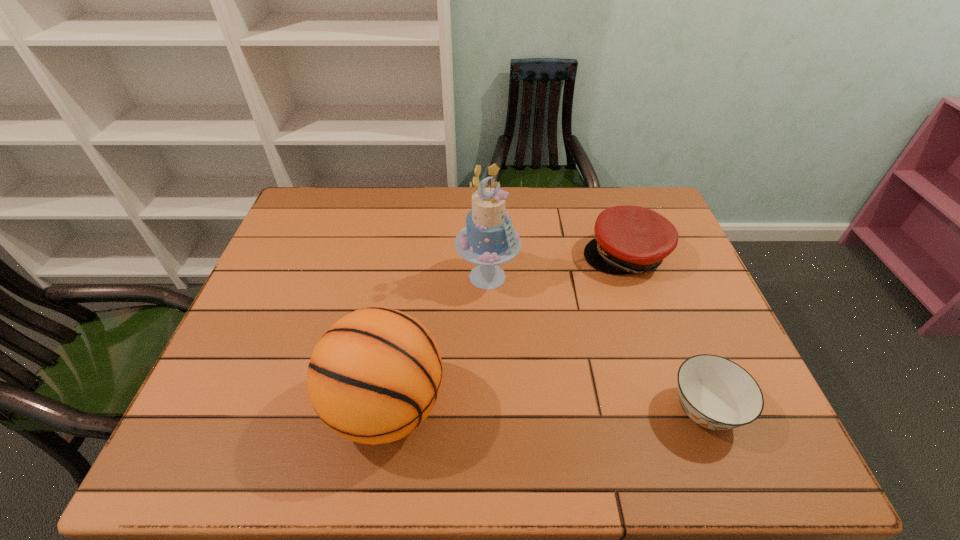
The height and width of the screenshot is (540, 960). In order to click on the leftmost object in this screenshot , I will do `click(374, 376)`.

Image resolution: width=960 pixels, height=540 pixels. In order to click on basketball in this screenshot , I will do `click(374, 376)`.

Locate an element on the screen. The image size is (960, 540). the shortest object is located at coordinates (x=716, y=393).

This screenshot has height=540, width=960. I want to click on cake, so click(489, 239).

Locate an element on the screen. The width and height of the screenshot is (960, 540). the tallest object is located at coordinates (489, 239).

Find the location of `the second shortest object`. the second shortest object is located at coordinates (628, 239).

Locate an element on the screen. free location located on the right of the leftmost object is located at coordinates click(x=478, y=407).

The height and width of the screenshot is (540, 960). In order to click on free space located on the back of the soup bowl in this screenshot , I will do `click(670, 323)`.

This screenshot has width=960, height=540. Identify the location of free space located 0.380m with a ladder on the side of the tallest object. (591, 410).

The image size is (960, 540). Identify the location of free spot located with a ladder on the side of the tallest object. (518, 316).